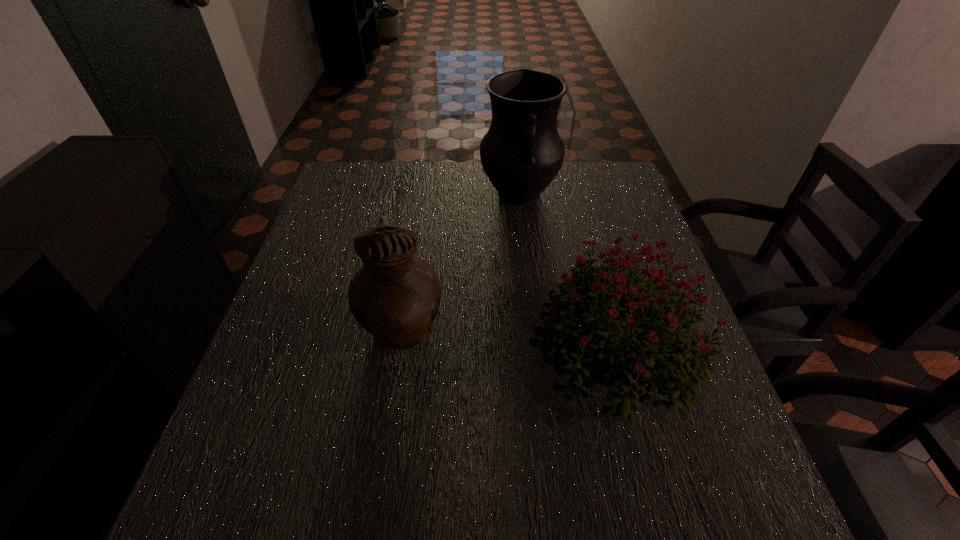
At what (x,y) coordinates should I click in order to perform the action: click on the farthest object. Please return your answer as a coordinate pair (x, y). Looking at the image, I should click on (522, 152).

The width and height of the screenshot is (960, 540). Find the location of `the right pitcher`. the right pitcher is located at coordinates (522, 152).

Identify the location of the left pitcher. The height and width of the screenshot is (540, 960). (395, 296).

This screenshot has height=540, width=960. Find the location of `the nearer pitcher`. the nearer pitcher is located at coordinates (395, 296).

Where is `bouquet`? The image size is (960, 540). bouquet is located at coordinates pyautogui.click(x=595, y=302).

Identify the location of vacant region located 0.240m on the handle side of the farther pitcher. Image resolution: width=960 pixels, height=540 pixels. (529, 283).

Where is `vacant space situated 0.150m at the spout of the nearer pitcher`? The image size is (960, 540). vacant space situated 0.150m at the spout of the nearer pitcher is located at coordinates (514, 335).

Where is `vacant space located 0.270m on the back of the bouquet`? Image resolution: width=960 pixels, height=540 pixels. vacant space located 0.270m on the back of the bouquet is located at coordinates (578, 219).

Find the location of a particular element. object that is at the far edge is located at coordinates (522, 152).

Where is `object that is positioned at the right edge`? object that is positioned at the right edge is located at coordinates (595, 302).